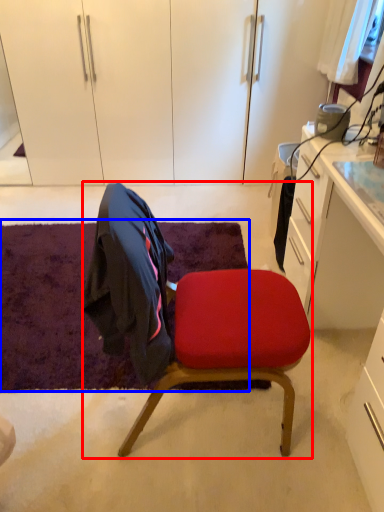
Question: Which object appears farthest to the camera in this image, chair (highlighted by a red box) or mat (highlighted by a blue box)?

Choices:
 (A) chair
 (B) mat

Answer: (B)